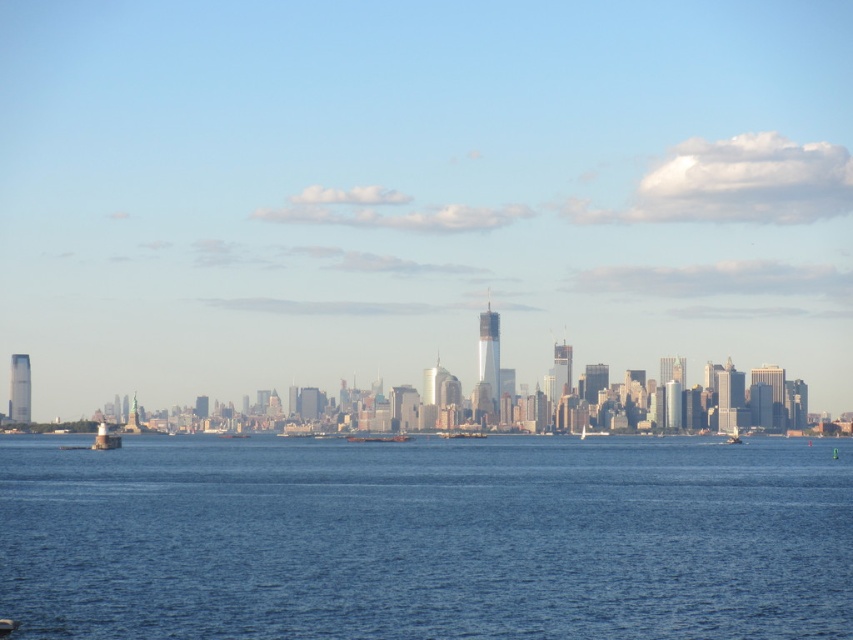
From the picture: Who is more forward, (102,497) or (447,435)?

Positioned in front is point (447,435).

The image size is (853, 640). In order to click on blue liquid water at center in this screenshot , I will do [427, 538].

Does point (280, 518) come closer to viewer compared to point (480, 433)?

That is False.

In order to click on blue liquid water at center in this screenshot , I will do [427, 538].

Between metallic silver boat at center and metallic gray boat at center, which one appears on the left side from the viewer's perspective?

From the viewer's perspective, metallic gray boat at center appears more on the left side.

Does metallic silver boat at center have a lesser height compared to metallic gray boat at center?

No.

Who is more forward, (469, 433) or (248, 435)?

Point (469, 433)

Find the location of a particular element. metallic silver boat at center is located at coordinates (462, 435).

Does point (148, 355) come behind point (241, 436)?

That is True.

Does point (392, 120) come in front of point (225, 432)?

No, it is behind (225, 432).

Find the location of a particular element. The height and width of the screenshot is (640, 853). transparent glass skyscrapers at center is located at coordinates (419, 192).